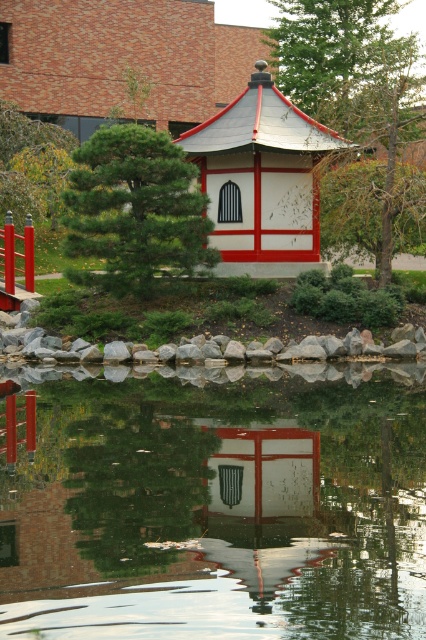
You are planning to place a small bench between the green leafy tree at center and the green textured tree at upper center. Based on their sizes, which tree would require more space around it for the bench to be placed comfortably?

The green leafy tree at center has a larger size compared to the green textured tree at upper center, so it would require more space around it for the bench to be placed comfortably.

You are a landscape architect designing a garden path that needs to pass between the green leafy tree at center and the green textured tree at upper center. Based on their heights, which tree should the path be closer to to ensure better visibility for visitors?

The path should be closer to the green textured tree at upper center because it is shorter than the green leafy tree at center, allowing for better visibility by avoiding obstruction from the taller tree.

You are standing at the edge of the water in the scene and want to reach the point marked as point (219, 214). Given that you can walk 100 feet before needing to rest, will you be able to reach that point without resting?

The distance between you and point (219, 214) is 89.13 feet, which is less than 100 feet. Therefore, you can reach the point without needing to rest.